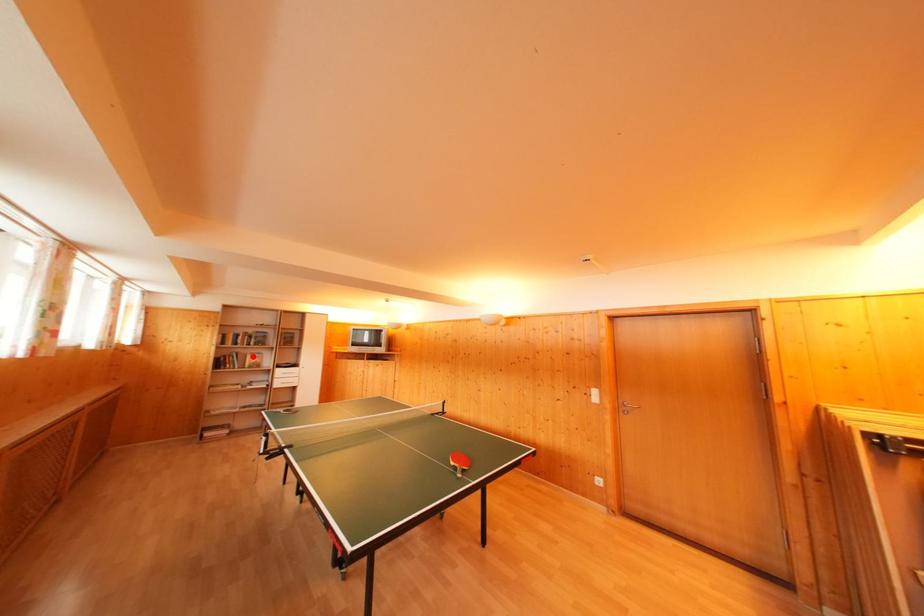
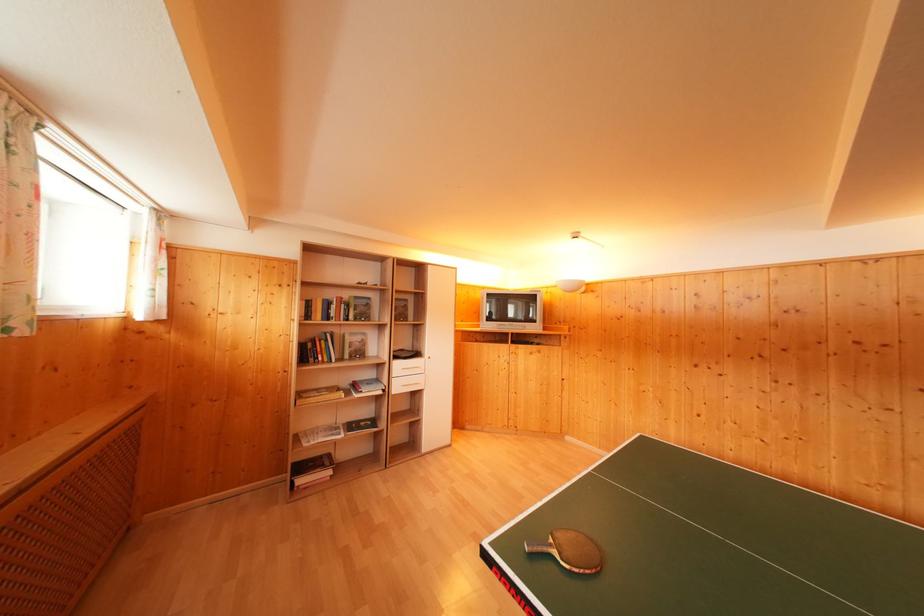
Question: I am providing you with two images of the same scene from different viewpoints. A red point is shown in image1. For the corresponding object point in image2, is it positioned nearer or farther from the camera?

Choices:
 (A) Nearer
 (B) Farther

Answer: (A)